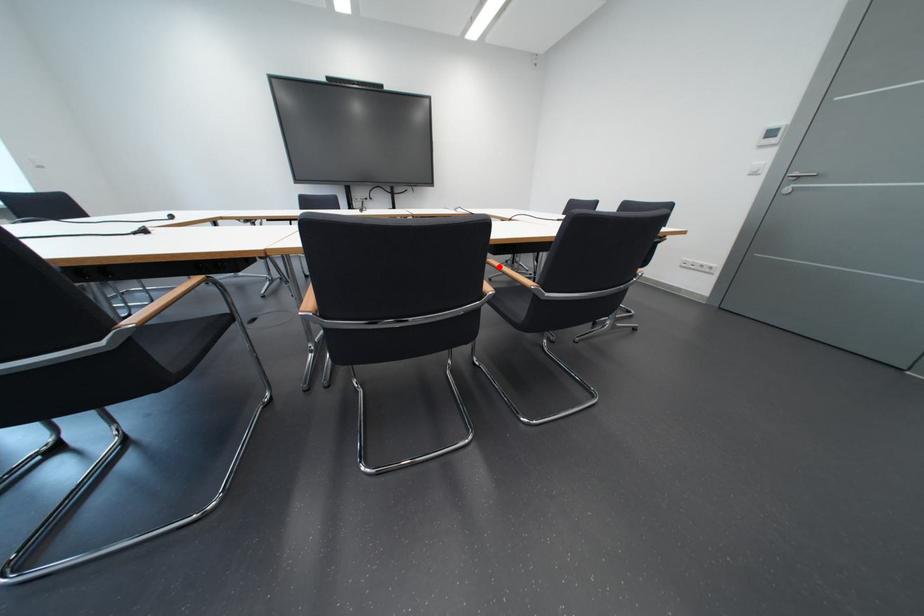
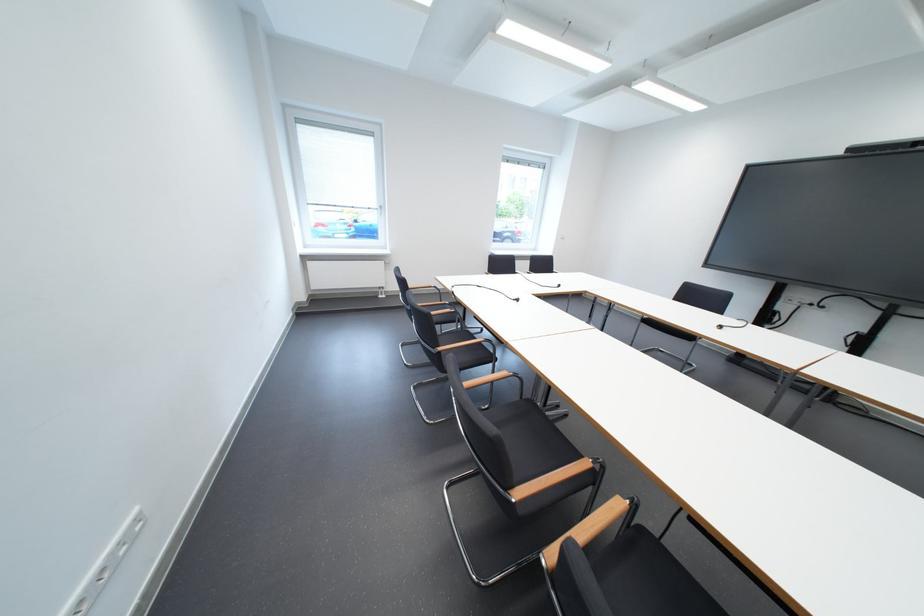
Question: I am providing you with two images of the same scene from different viewpoints. A red point is marked on the first image. Can you still see the location of the red point in image 2?

Choices:
 (A) Yes
 (B) No

Answer: (B)